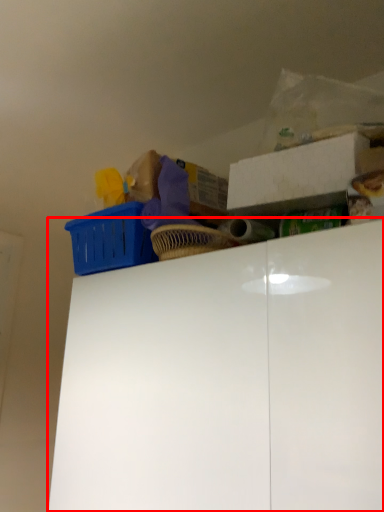
Question: In this image, where is cabinetry (annotated by the red box) located relative to storage box?

Choices:
 (A) right
 (B) left

Answer: (B)